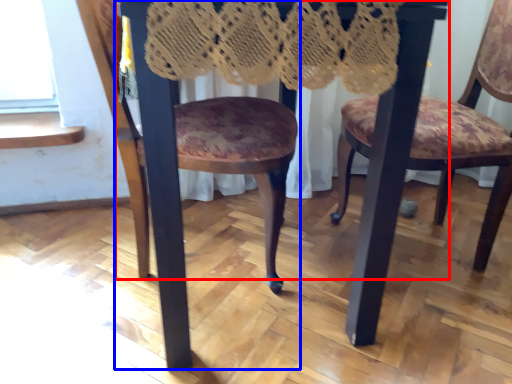
Question: Among these objects, which one is farthest to the camera, table (highlighted by a red box) or chair (highlighted by a blue box)?

Choices:
 (A) table
 (B) chair

Answer: (B)